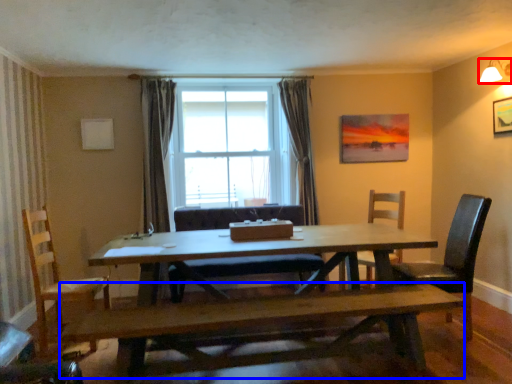
Question: Among these objects, which one is farthest to the camera, lamp (highlighted by a red box) or bench (highlighted by a blue box)?

Choices:
 (A) lamp
 (B) bench

Answer: (A)